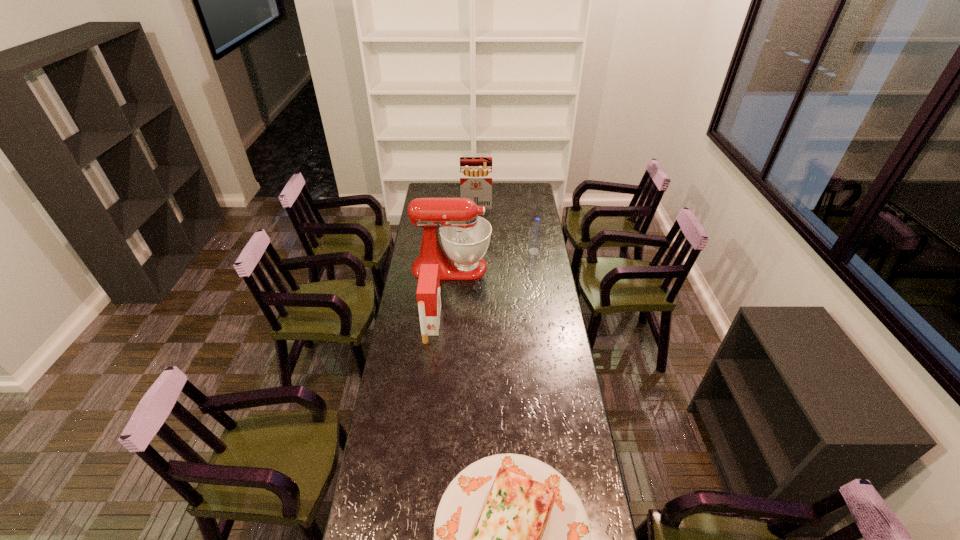
You are a GUI agent. You are given a task and a screenshot of the screen. Output one action in this format:
    pyautogui.click(x=<x>, y=<y>)
    Task: Click on the tallest object
    Image resolution: width=960 pixels, height=540 pixels.
    Given the screenshot: What is the action you would take?
    pyautogui.click(x=465, y=237)

Find the location of a particular element. The image size is (960, 540). the right cigarette case is located at coordinates (475, 172).

At what (x,y) coordinates should I click in order to perform the action: click on the taller cigarette case. Please return your answer as a coordinate pair (x, y). This screenshot has width=960, height=540. Looking at the image, I should click on (475, 172).

Find the location of a particular element. The width and height of the screenshot is (960, 540). the shorter cigarette case is located at coordinates (428, 293).

Locate an element on the screen. This screenshot has height=540, width=960. the third shortest object is located at coordinates (428, 293).

Image resolution: width=960 pixels, height=540 pixels. I want to click on the fourth tallest object, so click(535, 239).

Identify the location of free space located 0.320m at the attachment hub of the tallest object. (551, 267).

The image size is (960, 540). What are the coordinates of `blank area located with the lid open on the fourth shortest object` in the screenshot? It's located at (476, 244).

The height and width of the screenshot is (540, 960). I want to click on vacant position located on the front-facing side of the fourth farthest object, so click(455, 323).

This screenshot has height=540, width=960. What are the coordinates of `free space located 0.390m on the front of the second shortest object` in the screenshot? It's located at (542, 305).